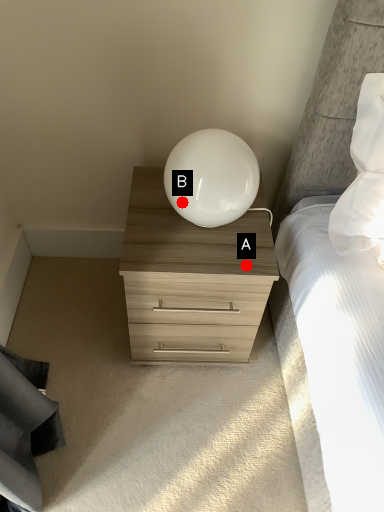
Question: Two points are circled on the image, labeled by A and B beside each circle. Which point appears closest to the camera in this image?

Choices:
 (A) A is closer
 (B) B is closer

Answer: (B)